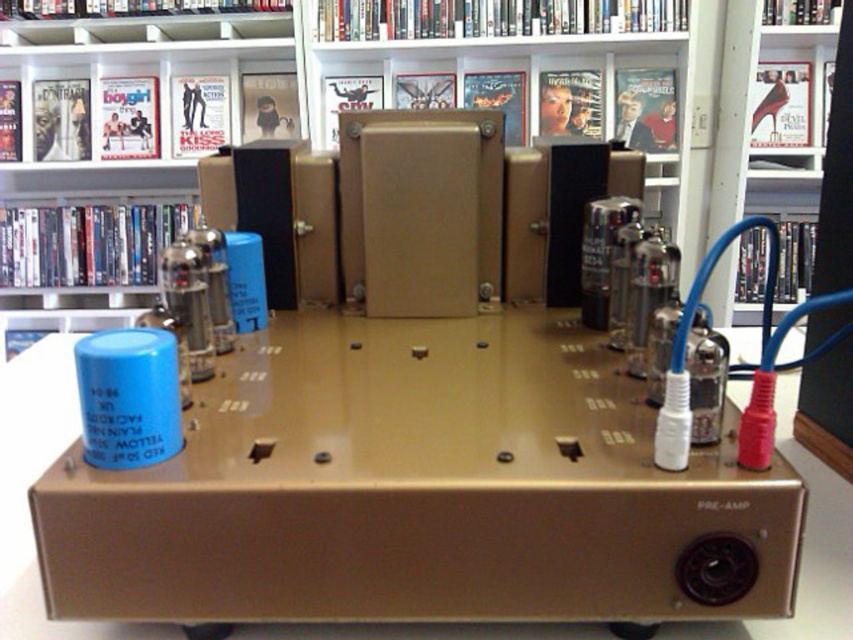
You are an engineer inspecting the vintage audio preamplifier. You notice two points marked on the image. The first point is at coordinates point (117, 176) and the second at point (846, 150). Which point is closer to the camera lens?

Point (117, 176) is closer to the camera lens than point (846, 150) because it is further to the camera than the other point.

You are an audio technician working on the vintage preamplifier. You need to connect a new cable to the component located at point [32,67]. However, there is another component at point [819,476] blocking your access. Can you reach the first point without moving the second component?

Point [32,67] is behind point [819,476], so you cannot reach it without moving the component at point [819,476].

You are an electrician working on the vintage audio preamplifier. You need to place a tool that is 12cm wide between the blue plastic capacitor at lower left and the matte black bookshelf at upper center. Is there enough space?

The blue plastic capacitor at lower left might be wider than matte black bookshelf at upper center, so the space between them may not be sufficient to fit a 12cm wide tool. Check the actual dimensions before placing the tool.